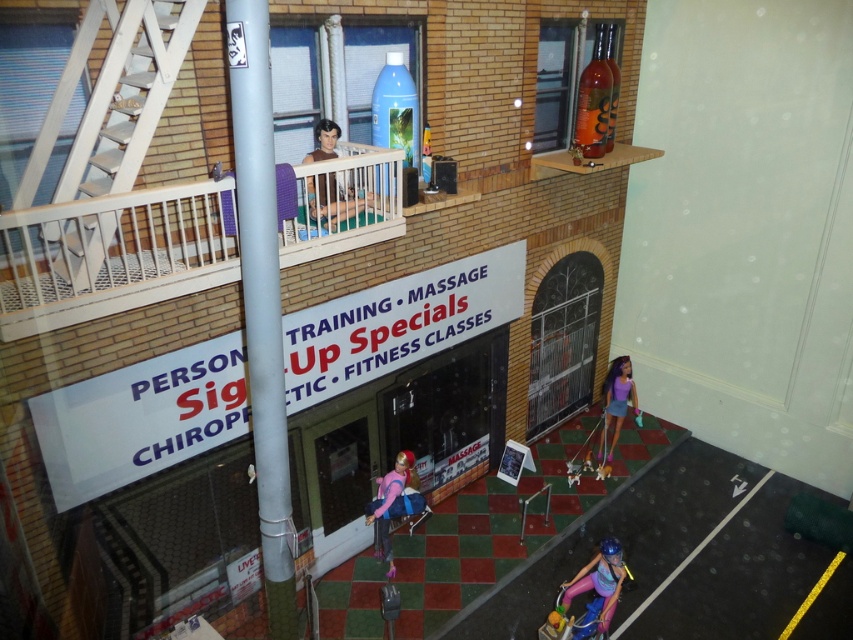
You are a visitor to this miniature city. You see the smooth brown doll at upper center and the purple fabric doll at lower right. Which doll is shorter?

The smooth brown doll at upper center is shorter than the purple fabric doll at lower right.

You are observing the miniature urban scene. There are two points marked in the image. The first point is at coordinate point (605, 580) and the second point is at coordinate point (610, 412). Which of these two points is closer to you, the observer?

Point (605, 580) is closer to the viewer than point (610, 412).

You are organizing a small exhibition and need to display both the pink fabric doll at center and the matte pink helmet at lower center on a shelf. If the shelf has limited space and you want to place them side by side without overlapping, which object should you place first to ensure they both fit?

The pink fabric doll at center is wider than the matte pink helmet at lower center. To ensure both fit side by side, place the wider pink fabric doll at center first, then the narrower matte pink helmet at lower center next to it.